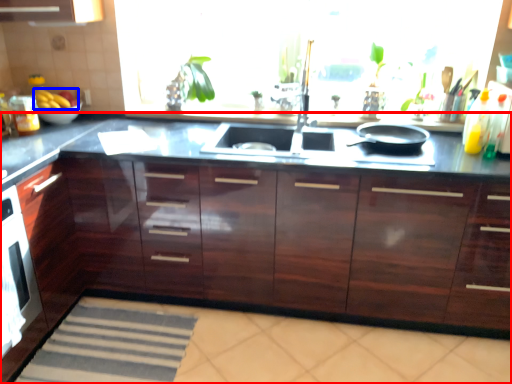
Question: Which of the following is the farthest to the observer, countertop (highlighted by a red box) or fruit (highlighted by a blue box)?

Choices:
 (A) countertop
 (B) fruit

Answer: (B)